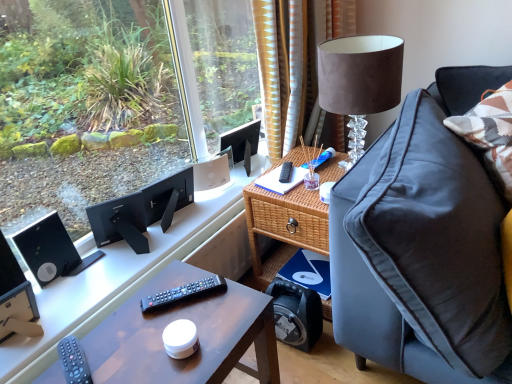
Question: Is black plastic speaker at upper left, which ranks as the second loudspeaker in front-to-back order, to the left of black plastic remote at center, marked as the 2th remote control in a back-to-front arrangement, from the viewer's perspective?

Choices:
 (A) no
 (B) yes

Answer: (B)

Question: From a real-world perspective, is black plastic speaker at upper left, which ranks as the second loudspeaker in front-to-back order, located higher than black plastic remote at center, marked as the 2th remote control in a right-to-left arrangement?

Choices:
 (A) yes
 (B) no

Answer: (B)

Question: Is black plastic remote at center, arranged as the 2th remote control when viewed from the front, inside black plastic speaker at upper left, which appears as the first loudspeaker when viewed from the back?

Choices:
 (A) yes
 (B) no

Answer: (B)

Question: Can you confirm if black plastic speaker at upper left, which ranks as the second loudspeaker in front-to-back order, is thinner than black plastic remote at center, the second remote control in the top-to-bottom sequence?

Choices:
 (A) yes
 (B) no

Answer: (B)

Question: Is black plastic remote at center, the second remote control in the top-to-bottom sequence, at the back of black plastic speaker at upper left, which ranks as the second loudspeaker in front-to-back order?

Choices:
 (A) yes
 (B) no

Answer: (B)

Question: Considering the relative positions of black plastic speaker at upper left, which ranks as the second loudspeaker in front-to-back order, and black plastic remote at center, the second remote control ordered from the bottom, in the image provided, is black plastic speaker at upper left, which ranks as the second loudspeaker in front-to-back order, to the right of black plastic remote at center, the second remote control ordered from the bottom, from the viewer's perspective?

Choices:
 (A) yes
 (B) no

Answer: (B)

Question: Can you confirm if black plastic speaker at upper left, which appears as the first loudspeaker when viewed from the back, is shorter than black plastic speaker at lower left, which is counted as the first loudspeaker, starting from the front?

Choices:
 (A) yes
 (B) no

Answer: (A)

Question: Is black plastic speaker at upper left, which appears as the first loudspeaker when viewed from the back, outside of black plastic speaker at lower left, the second loudspeaker in the back-to-front sequence?

Choices:
 (A) no
 (B) yes

Answer: (B)

Question: From the image's perspective, is black plastic speaker at upper left, which appears as the first loudspeaker when viewed from the back, below black plastic speaker at lower left, which is counted as the first loudspeaker, starting from the front?

Choices:
 (A) yes
 (B) no

Answer: (B)

Question: Can you confirm if black plastic speaker at upper left, which appears as the first loudspeaker when viewed from the back, is smaller than black plastic speaker at lower left, which is counted as the first loudspeaker, starting from the front?

Choices:
 (A) no
 (B) yes

Answer: (B)

Question: Is black plastic speaker at upper left, which ranks as the second loudspeaker in front-to-back order, at the left side of black plastic speaker at lower left, the second loudspeaker in the back-to-front sequence?

Choices:
 (A) no
 (B) yes

Answer: (A)

Question: From a real-world perspective, is black plastic speaker at upper left, which appears as the first loudspeaker when viewed from the back, under black plastic speaker at lower left, which is counted as the first loudspeaker, starting from the front?

Choices:
 (A) no
 (B) yes

Answer: (B)

Question: Considering the relative sizes of matte black remote control at lower left, which is counted as the third remote control, starting from the right, and black matte computer desk at left in the image provided, is matte black remote control at lower left, which is counted as the third remote control, starting from the right, thinner than black matte computer desk at left?

Choices:
 (A) yes
 (B) no

Answer: (A)